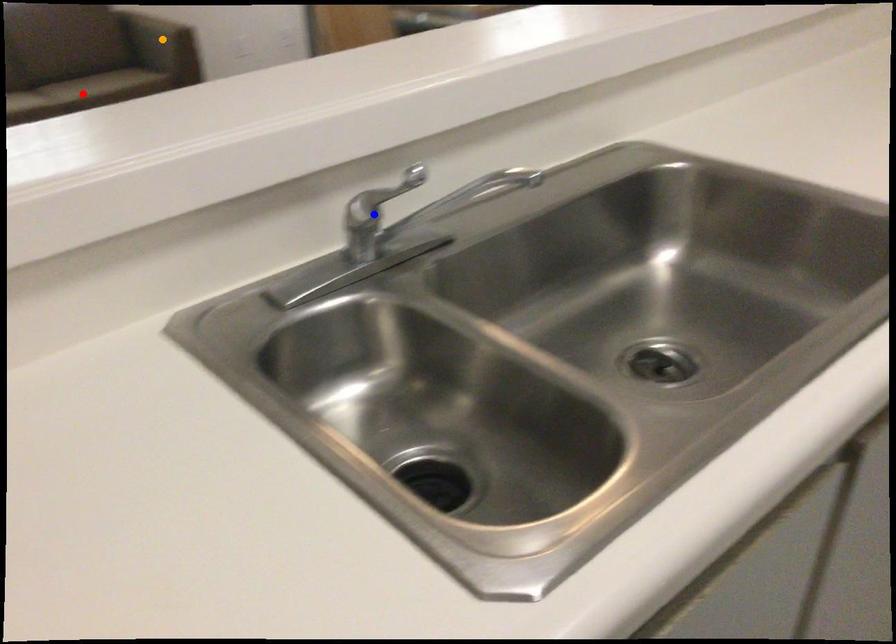
Order these from nearest to farthest:
- blue point
- orange point
- red point

blue point < orange point < red point